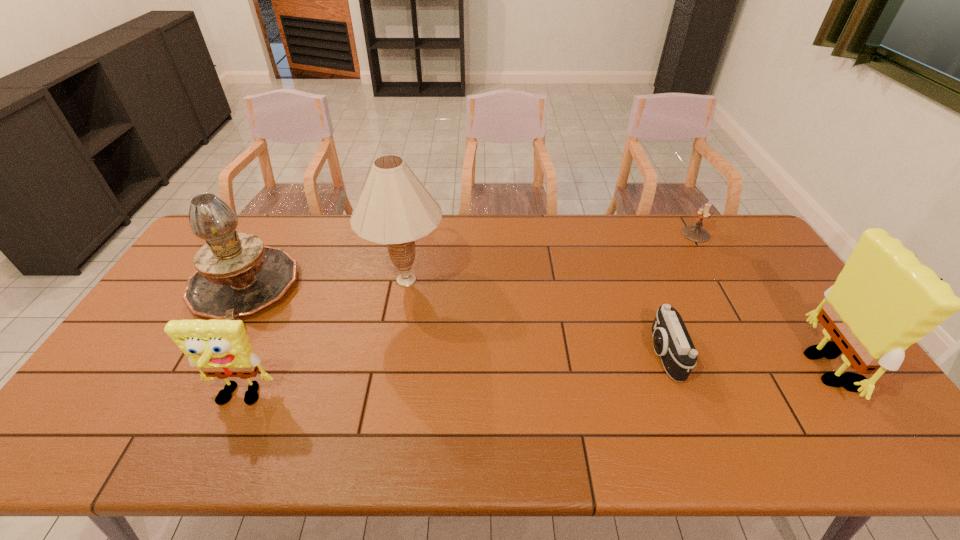
Find the location of a particular element. spot to insert another sponge for uniform distribution is located at coordinates (546, 383).